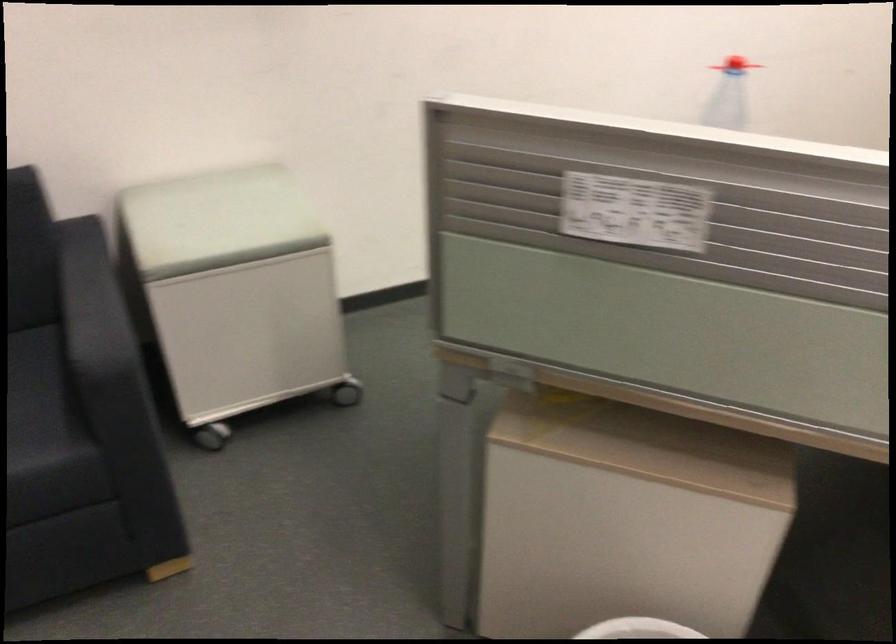
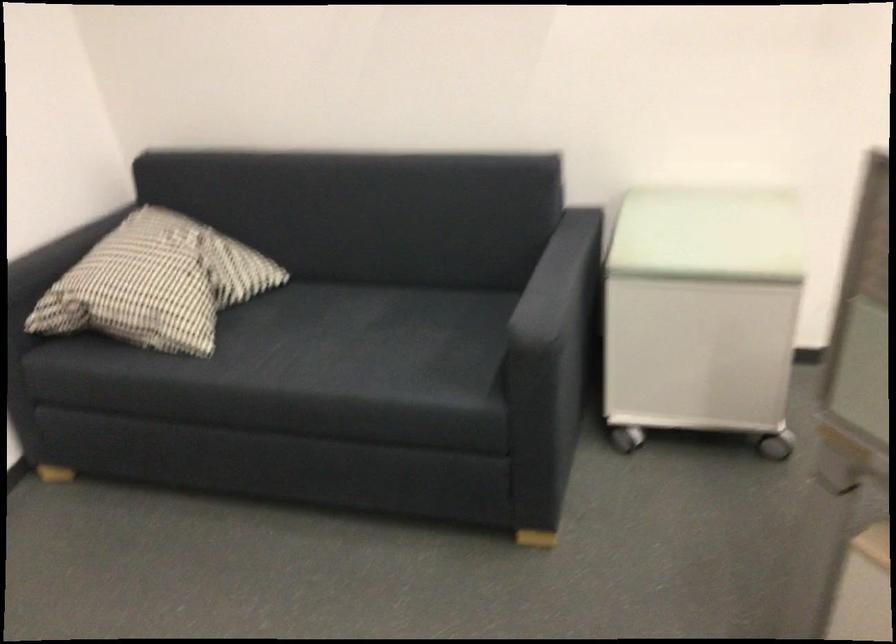
Question: Based on the continuous images, in which direction is the camera rotating? Reply with the corresponding letter.

Choices:
 (A) Left
 (B) Right
 (C) Up
 (D) Down

Answer: (A)